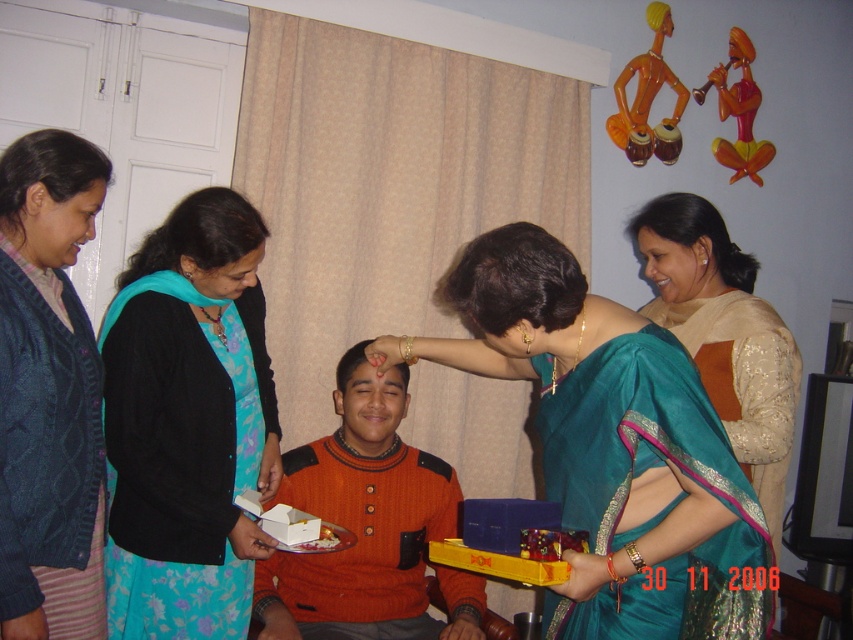
Question: Does teal silk saree at center appear over orange matte wooden toy at upper right?

Choices:
 (A) no
 (B) yes

Answer: (A)

Question: Is teal silk saree at center to the left of orange knitted sweater at center from the viewer's perspective?

Choices:
 (A) yes
 (B) no

Answer: (B)

Question: Among these points, which one is farthest from the camera?

Choices:
 (A) (293, 547)
 (B) (730, 312)
 (C) (583, 280)

Answer: (B)

Question: Estimate the real-world distances between objects in this image. Which object is farther from the yellow plastic tray at lower center?

Choices:
 (A) teal floral dress at center
 (B) orange knitted sweater at center
 (C) white paper at center
 (D) knitted dark blue cardigan at left

Answer: (D)

Question: Is the position of orange knitted sweater at center less distant than that of teal silk saree at upper right?

Choices:
 (A) yes
 (B) no

Answer: (B)

Question: Which of the following is the farthest from the observer?

Choices:
 (A) (502, 541)
 (B) (791, 412)

Answer: (B)